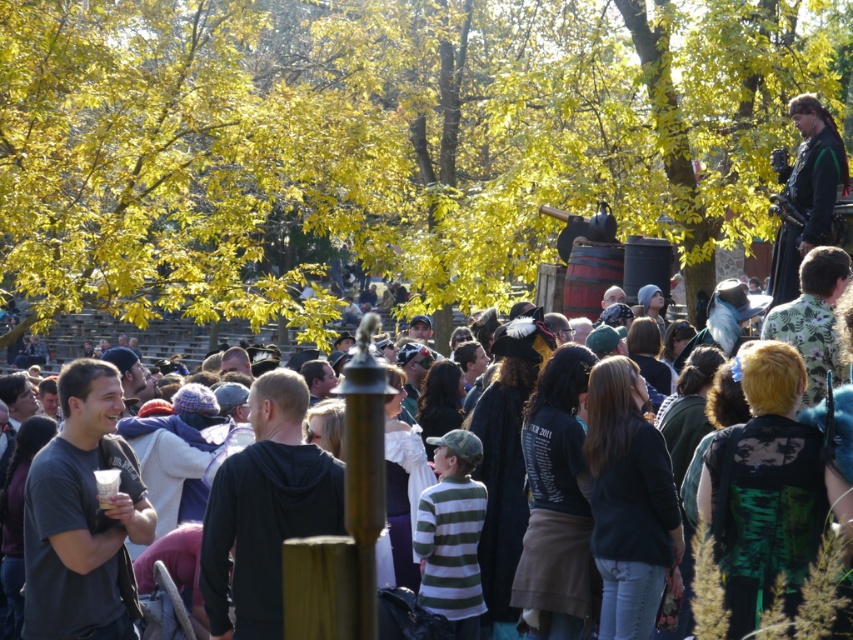
You are at an autumn festival and see the yellow leafy tree at upper center and the dark green leather jacket at upper right. Which object takes up more space in the image?

The yellow leafy tree at upper center takes up more space in the image because it is bigger than the dark green leather jacket at upper right.